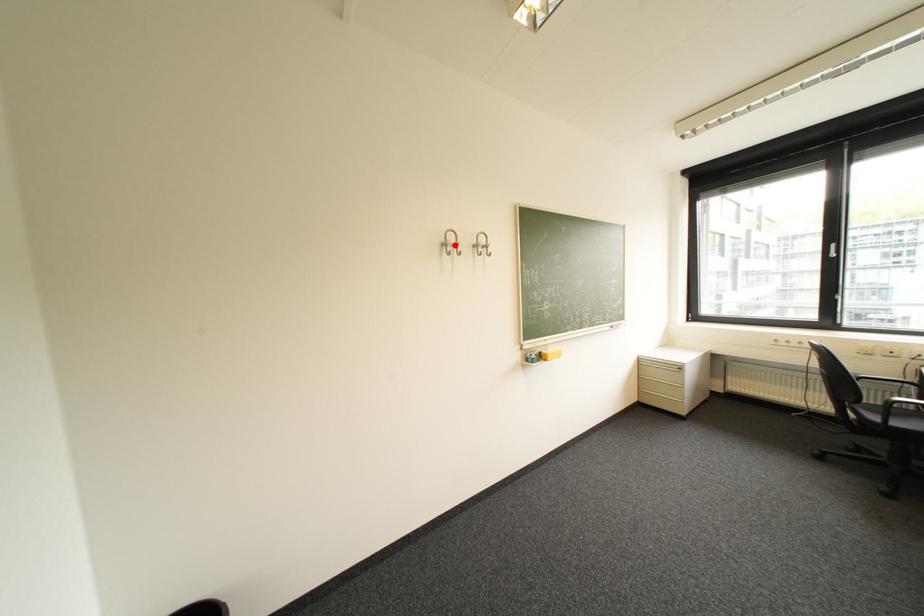
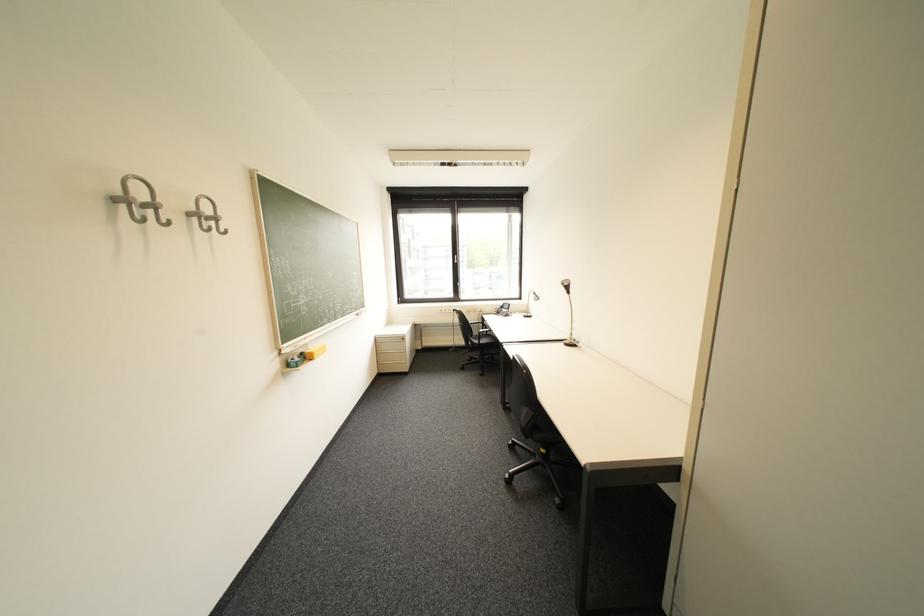
In the second image, find the point that corresponds to the highlighted location in the first image.

(130, 201)